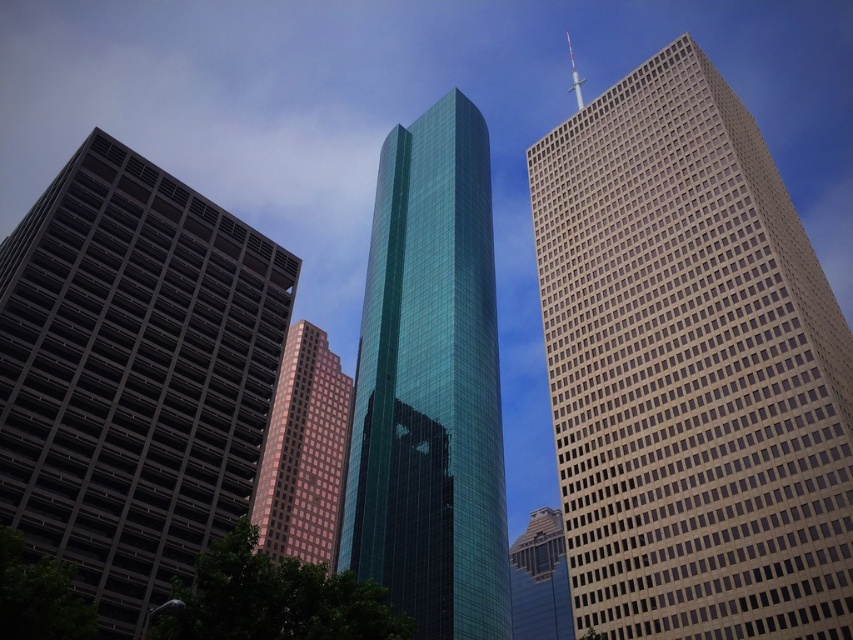
Question: Is beige grid-patterned building at right bigger than shiny glass skyscraper at center?

Choices:
 (A) yes
 (B) no

Answer: (B)

Question: Is beige grid-patterned building at right closer to the viewer compared to dark gray concrete building at left?

Choices:
 (A) yes
 (B) no

Answer: (A)

Question: Which point is farther to the camera?

Choices:
 (A) dark gray concrete building at left
 (B) green glass skyscraper at center

Answer: (B)

Question: Which object is closer to the camera taking this photo?

Choices:
 (A) green glass skyscraper at center
 (B) beige grid-patterned building at right
 (C) shiny glass skyscraper at center
 (D) pink glass building at center

Answer: (B)

Question: Considering the relative positions of green glass skyscraper at center and shiny glass skyscraper at center in the image provided, where is green glass skyscraper at center located with respect to shiny glass skyscraper at center?

Choices:
 (A) right
 (B) left

Answer: (B)

Question: Which point appears farthest from the camera in this image?

Choices:
 (A) (758, 390)
 (B) (378, 486)
 (C) (318, 340)

Answer: (C)